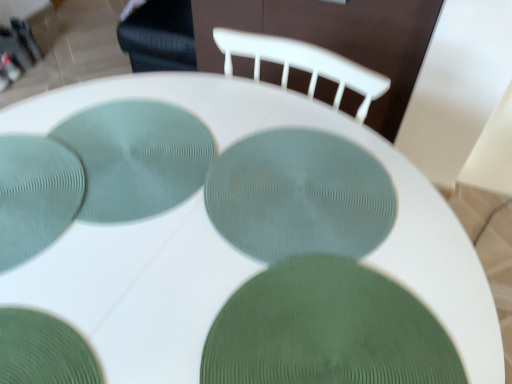
Where is `free location above teal textured placemat at center, the third glass plate viewed from the left (from a real-world perspective)`? free location above teal textured placemat at center, the third glass plate viewed from the left (from a real-world perspective) is located at coordinates (129, 152).